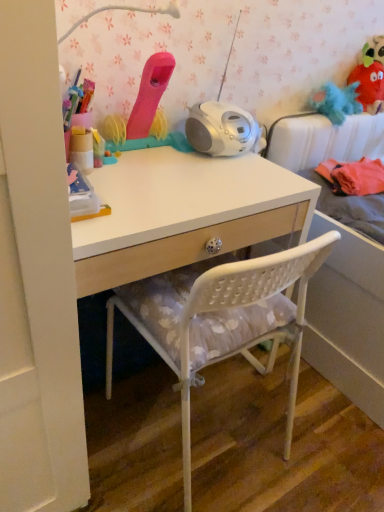
Question: Is matte pink toy at upper center, arranged as the first toy when viewed from the front, inside fuzzy fabric plush at upper right, arranged as the 1th toy when viewed from the back?

Choices:
 (A) yes
 (B) no

Answer: (B)

Question: Does fuzzy fabric plush at upper right, acting as the first toy starting from the right, lie behind matte pink toy at upper center, the 1th toy when ordered from left to right?

Choices:
 (A) yes
 (B) no

Answer: (A)

Question: Is fuzzy fabric plush at upper right, which ranks as the third toy in left-to-right order, thinner than matte pink toy at upper center, arranged as the first toy when viewed from the front?

Choices:
 (A) no
 (B) yes

Answer: (A)

Question: Does fuzzy fabric plush at upper right, arranged as the 1th toy when viewed from the back, turn towards matte pink toy at upper center, placed as the third toy when sorted from right to left?

Choices:
 (A) yes
 (B) no

Answer: (B)

Question: Can you confirm if fuzzy fabric plush at upper right, marked as the third toy in a front-to-back arrangement, is positioned to the right of matte pink toy at upper center, arranged as the first toy when viewed from the front?

Choices:
 (A) yes
 (B) no

Answer: (A)

Question: Does fuzzy fabric plush at upper right, marked as the third toy in a front-to-back arrangement, have a larger size compared to matte pink toy at upper center, arranged as the first toy when viewed from the front?

Choices:
 (A) no
 (B) yes

Answer: (A)

Question: From a real-world perspective, is white matte desk at center positioned over blue fluffy toy at upper right, the 2th toy viewed from the front, based on gravity?

Choices:
 (A) no
 (B) yes

Answer: (A)

Question: Is white matte desk at center looking in the opposite direction of blue fluffy toy at upper right, which is the 2th toy in left-to-right order?

Choices:
 (A) yes
 (B) no

Answer: (B)

Question: Is there a large distance between white matte desk at center and blue fluffy toy at upper right, the 2th toy in the back-to-front sequence?

Choices:
 (A) no
 (B) yes

Answer: (A)

Question: Considering the relative positions of white matte desk at center and blue fluffy toy at upper right, the 2th toy in the back-to-front sequence, in the image provided, is white matte desk at center to the right of blue fluffy toy at upper right, the 2th toy in the back-to-front sequence, from the viewer's perspective?

Choices:
 (A) no
 (B) yes

Answer: (A)

Question: From the image's perspective, does white matte desk at center appear higher than blue fluffy toy at upper right, the 2th toy in the back-to-front sequence?

Choices:
 (A) no
 (B) yes

Answer: (A)

Question: Can we say white matte desk at center lies outside blue fluffy toy at upper right, the 2th toy in the back-to-front sequence?

Choices:
 (A) no
 (B) yes

Answer: (B)

Question: Does white plastic chair at center turn towards fuzzy fabric plush at upper right, which ranks as the third toy in left-to-right order?

Choices:
 (A) no
 (B) yes

Answer: (A)